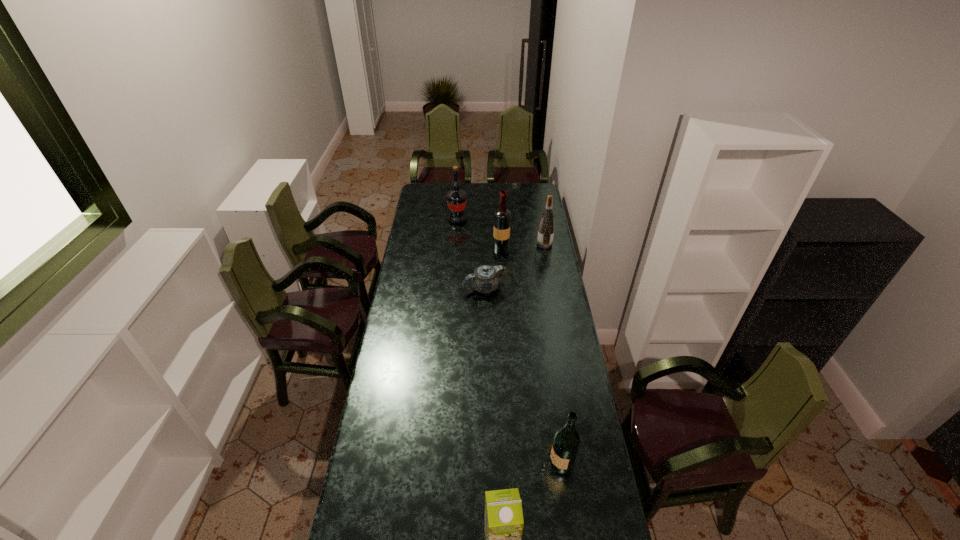
Locate an element on the screen. The width and height of the screenshot is (960, 540). empty space that is in between the farthest object and the chinaware is located at coordinates (470, 254).

Locate an element on the screen. The width and height of the screenshot is (960, 540). empty space between the shortest object and the farthest wine bottle is located at coordinates [470, 254].

Identify the location of object identified as the fifth closest to the third wine bottle from right to left. (504, 522).

Find the location of `the fifth closest object relative to the chinaware`. the fifth closest object relative to the chinaware is located at coordinates (504, 522).

Find the location of `wine bottle that is the third closest to the nearest object`. wine bottle that is the third closest to the nearest object is located at coordinates (546, 228).

Choose which wine bottle is the third nearest neighbor to the third wine bottle from right to left. Please provide its 2D coordinates. Your answer should be formatted as a tuple, i.e. [(x, y)], where the tuple contains the x and y coordinates of a point satisfying the conditions above.

[(566, 442)]

Identify the location of free space in the image that satisfies the following two spatial constraints: 1. from the spout of the fifth farthest object; 2. on the right side of the shortest object. This screenshot has width=960, height=540. (486, 461).